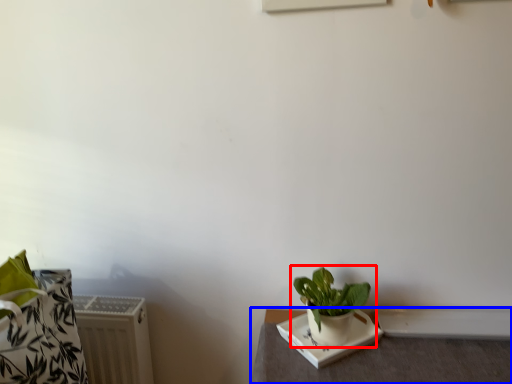
Question: Which object appears closest to the camera in this image, houseplant (highlighted by a red box) or table (highlighted by a blue box)?

Choices:
 (A) houseplant
 (B) table

Answer: (B)